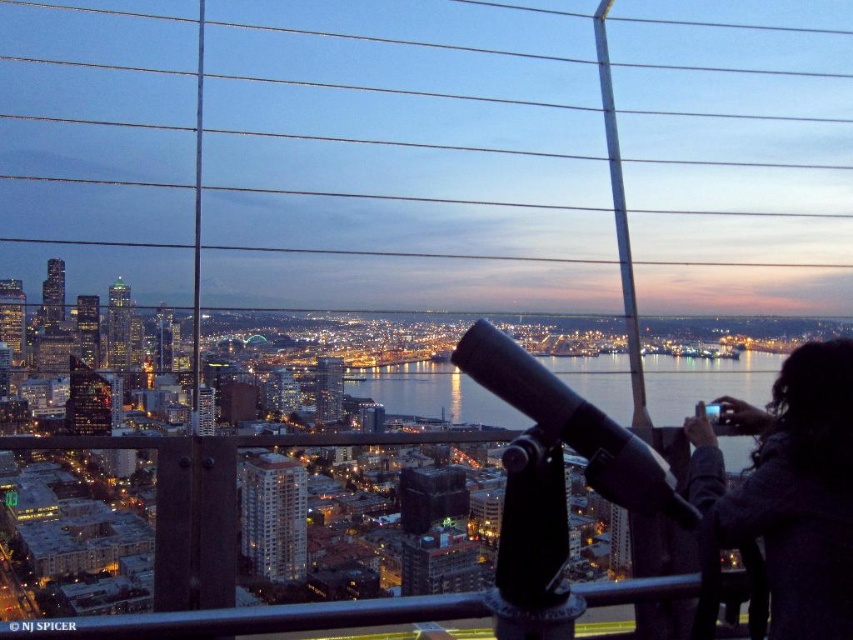
Is dark gray wool coat at lower right bigger than black matte telescope at center?

Incorrect, dark gray wool coat at lower right is not larger than black matte telescope at center.

The width and height of the screenshot is (853, 640). What do you see at coordinates (784, 493) in the screenshot?
I see `dark gray wool coat at lower right` at bounding box center [784, 493].

This screenshot has height=640, width=853. Identify the location of dark gray wool coat at lower right. (784, 493).

The height and width of the screenshot is (640, 853). Find the location of `dark gray wool coat at lower right`. dark gray wool coat at lower right is located at coordinates (784, 493).